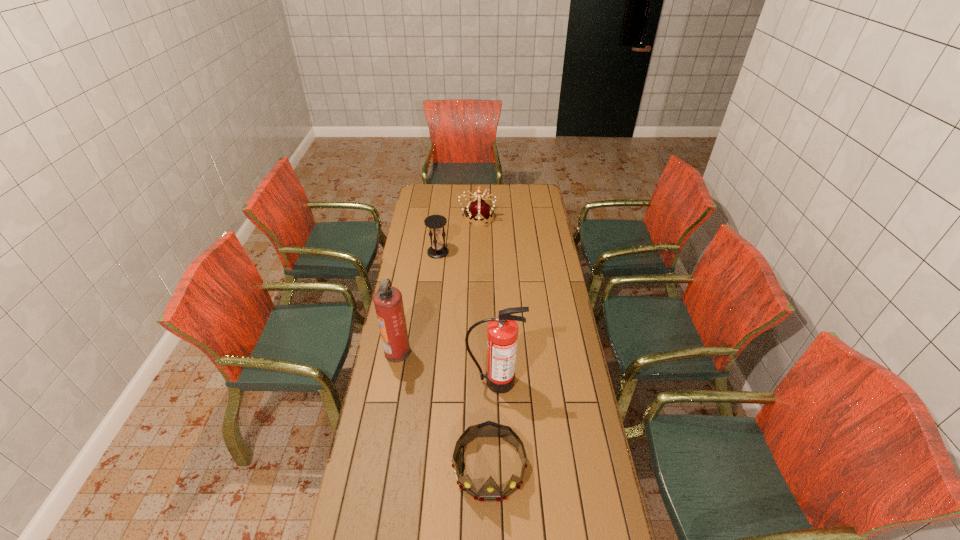
Locate which tiara is the closest to the leftmost object. Please provide its 2D coordinates. Your answer should be formatted as a tuple, i.e. [(x, y)], where the tuple contains the x and y coordinates of a point satisfying the conditions above.

[(490, 491)]

At what (x,y) coordinates should I click in order to perform the action: click on free location that satisfies the following two spatial constraints: 1. on the front-facing side of the farthest object; 2. on the front side of the hourglass. Please return your answer as a coordinate pair (x, y). Looking at the image, I should click on (477, 252).